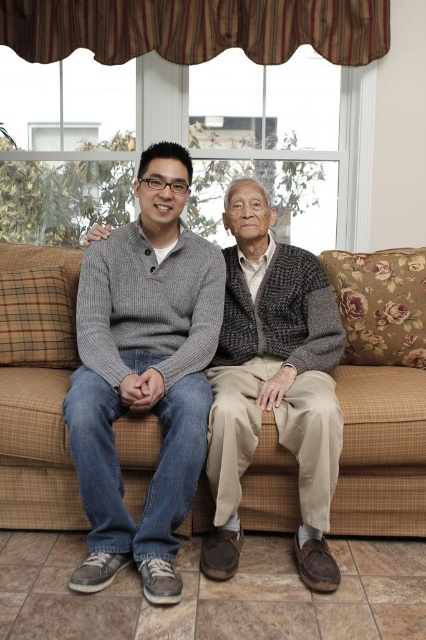
Question: Can you confirm if gray knitted sweater at center is positioned to the left of brown plaid couch at center?

Choices:
 (A) no
 (B) yes

Answer: (A)

Question: Among these objects, which one is farthest from the camera?

Choices:
 (A) gray knitted sweater at center
 (B) brown plaid couch at center
 (C) knit sweater at center

Answer: (B)

Question: Can you confirm if gray knitted sweater at center is positioned to the left of knit sweater at center?

Choices:
 (A) no
 (B) yes

Answer: (B)

Question: Considering the real-world distances, which object is farthest from the knit sweater at center?

Choices:
 (A) brown plaid couch at center
 (B) gray knitted sweater at center

Answer: (A)

Question: Which of the following is the farthest from the observer?

Choices:
 (A) knit sweater at center
 (B) brown plaid couch at center

Answer: (B)

Question: Can you confirm if gray knitted sweater at center is positioned above brown plaid couch at center?

Choices:
 (A) no
 (B) yes

Answer: (B)